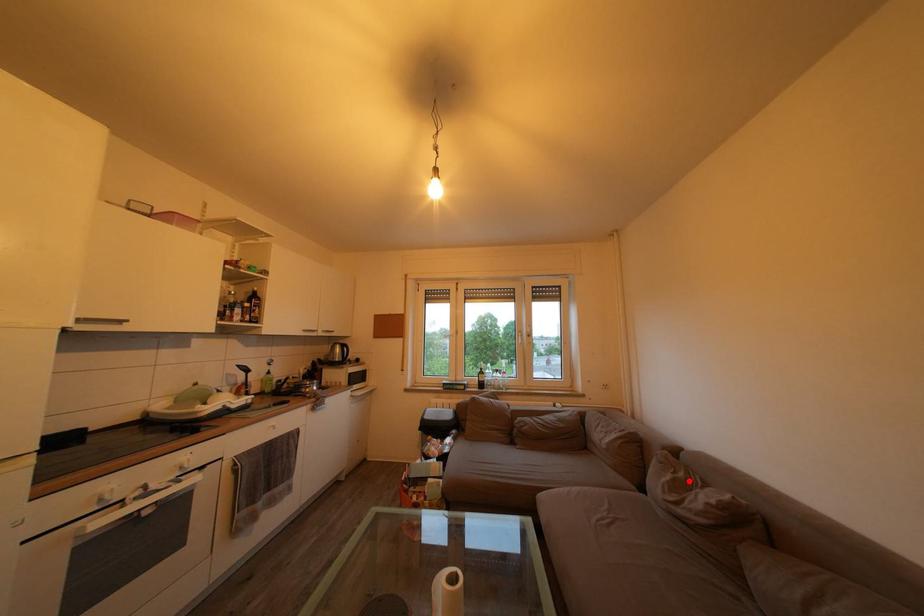
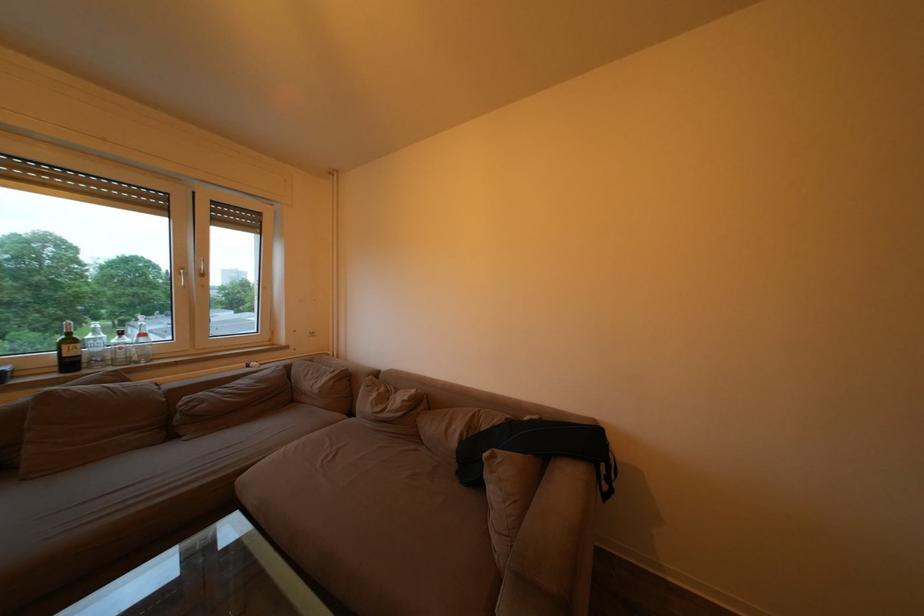
Find the pixel in the second image that matches the highlighted location in the first image.

(390, 395)